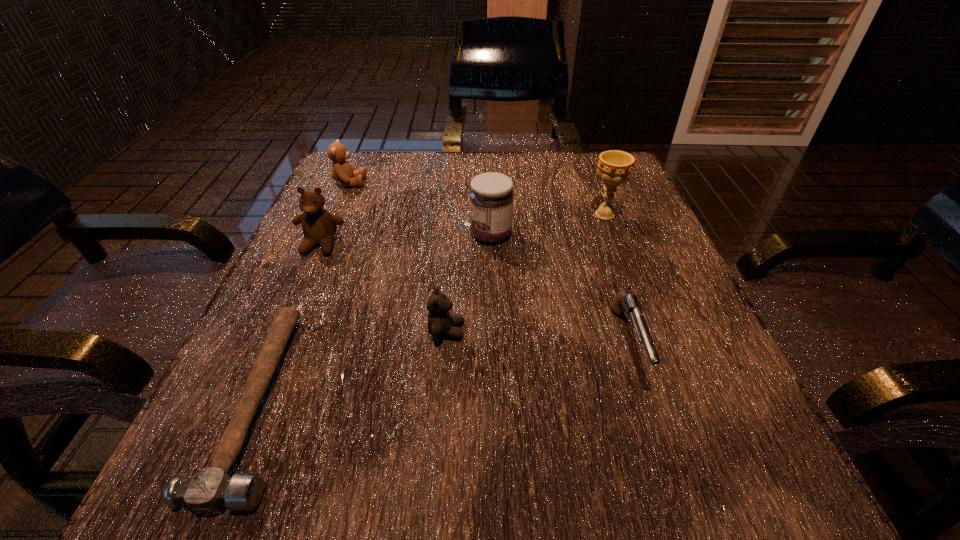
Find the location of `chalice`. chalice is located at coordinates (614, 167).

Find the location of a particular element. the third object from right to left is located at coordinates (491, 196).

The height and width of the screenshot is (540, 960). I want to click on the tallest teddy bear, so click(319, 226).

The height and width of the screenshot is (540, 960). I want to click on the farthest object, so click(x=344, y=173).

Locate an element on the screen. This screenshot has width=960, height=540. the rightmost teddy bear is located at coordinates point(440,323).

At what (x,y) coordinates should I click in order to perform the action: click on the shortest teddy bear. Please return your answer as a coordinate pair (x, y). This screenshot has height=540, width=960. Looking at the image, I should click on (440, 323).

Find the location of a particular element. The image size is (960, 540). the sixth tallest object is located at coordinates (628, 303).

Find the location of a particular element. the shortest object is located at coordinates (209, 491).

Where is `vacant space situated on the front of the chalice`? The height and width of the screenshot is (540, 960). vacant space situated on the front of the chalice is located at coordinates (665, 378).

The width and height of the screenshot is (960, 540). Find the location of `free space located on the front label of the jam`. free space located on the front label of the jam is located at coordinates (306, 234).